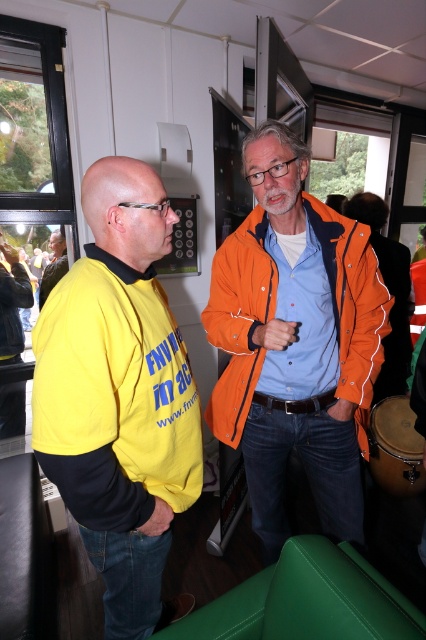
Question: Is orange matte jacket at center to the left of brown leather drum at lower right from the viewer's perspective?

Choices:
 (A) no
 (B) yes

Answer: (B)

Question: Estimate the real-world distances between objects in this image. Which object is closer to the orange fabric jacket at center?

Choices:
 (A) yellow fabric shirt at left
 (B) yellow matte t-shirt at left
 (C) orange matte jacket at center
 (D) brown leather drum at lower right

Answer: (D)

Question: Which of the following is the farthest from the observer?

Choices:
 (A) [414, 432]
 (B) [380, 250]
 (C) [271, 420]
 (D) [48, 282]

Answer: (D)

Question: Does yellow matte t-shirt at left have a lesser width compared to orange matte jacket at center?

Choices:
 (A) no
 (B) yes

Answer: (B)

Question: Can you confirm if brown leather drum at lower right is thinner than yellow fabric shirt at left?

Choices:
 (A) yes
 (B) no

Answer: (A)

Question: Which object is farther from the camera taking this photo?

Choices:
 (A) orange matte jacket at center
 (B) brown leather drum at lower right
 (C) yellow fabric shirt at left

Answer: (C)